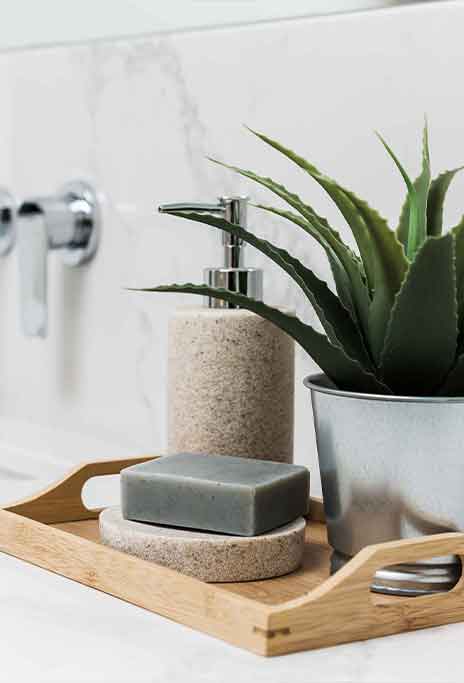
Locate an element on the screen. This screenshot has width=464, height=683. soap dispenser is located at coordinates (225, 345).